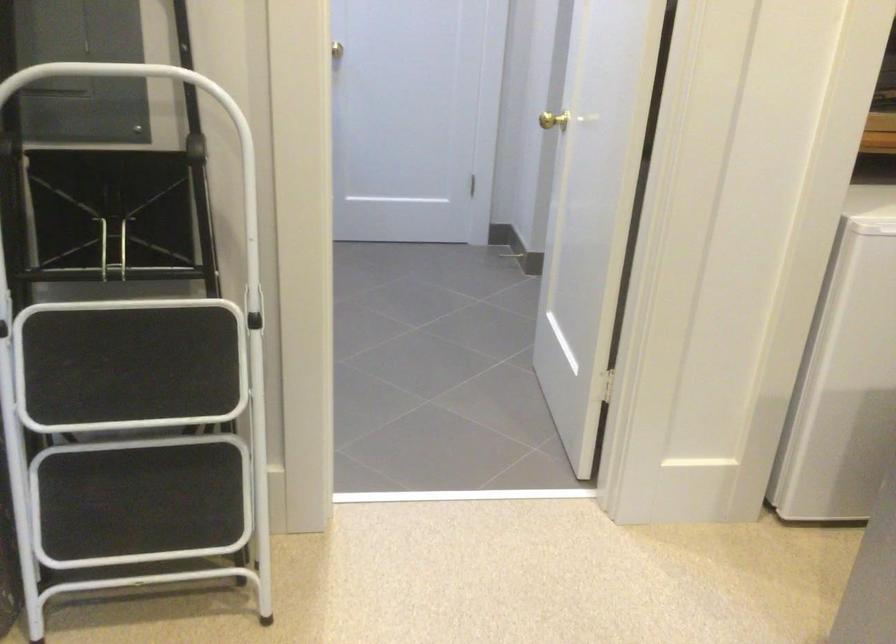
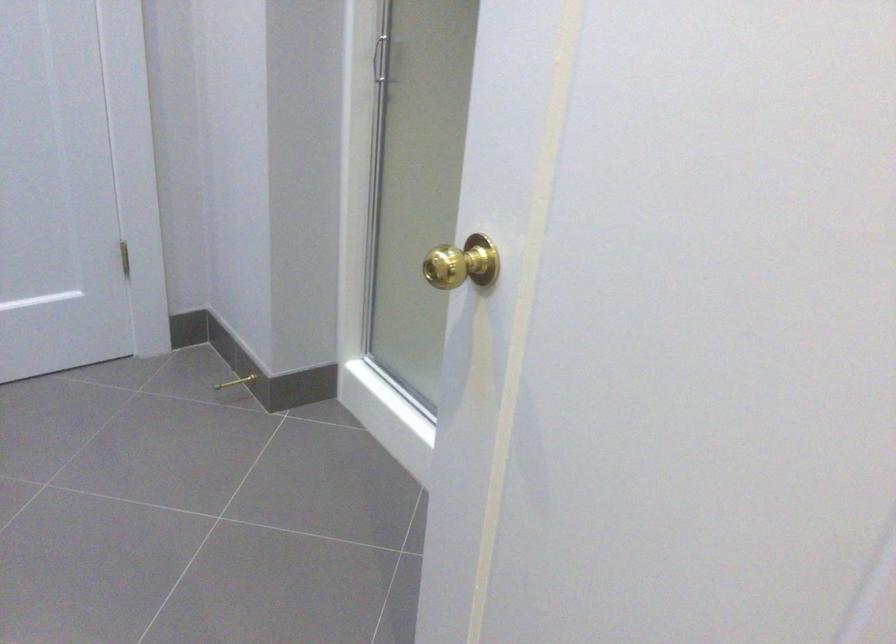
Find the pixel in the second image that matches the point at 529,260 in the first image.

(235, 382)